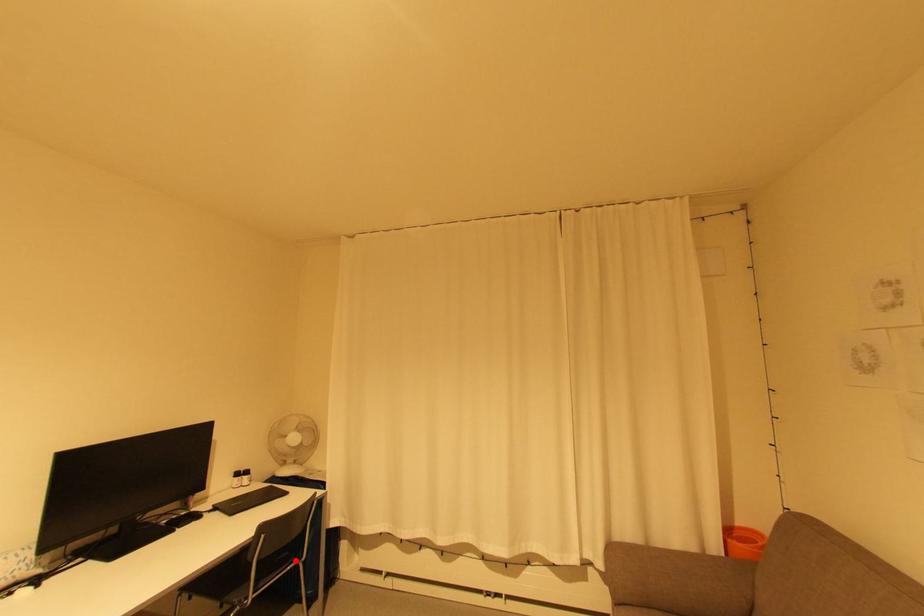
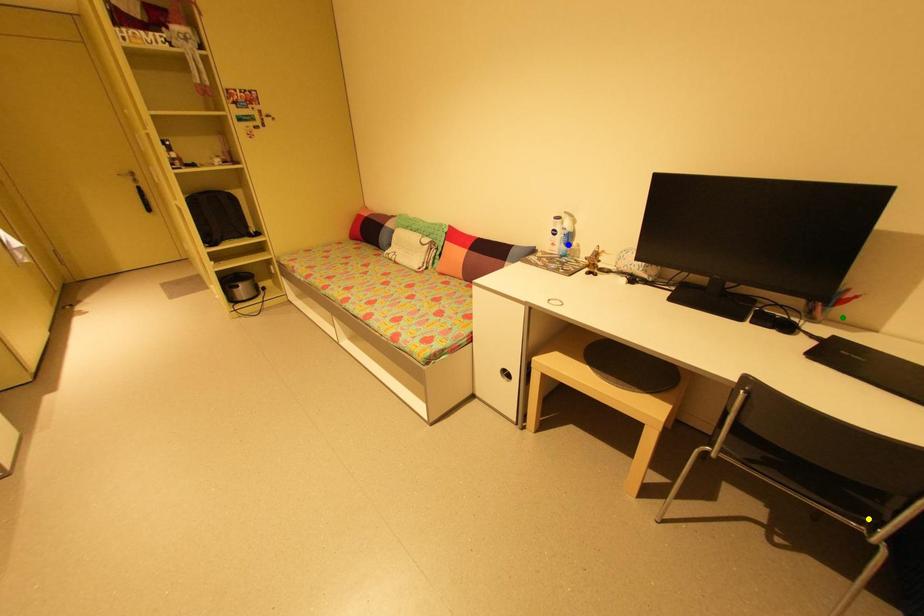
Question: I am providing you with two images of the same scene from different viewpoints. A red point is marked on the first image. You are given multiple points on the second image. Which point in image 2 is actually the same real-world point as the red point in image 1?

Choices:
 (A) yellow point
 (B) blue point
 (C) green point

Answer: (A)